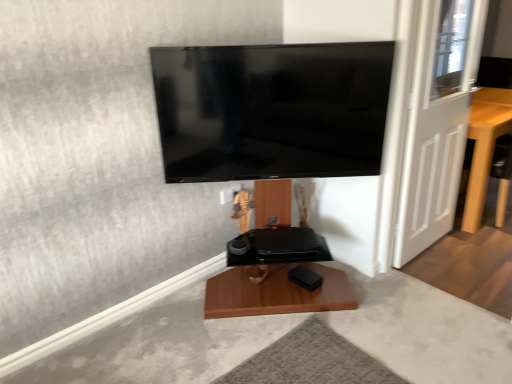
Question: Is white wooden door at right at the left side of light brown wooden table at right?

Choices:
 (A) no
 (B) yes

Answer: (B)

Question: Considering the relative sizes of white wooden door at right and light brown wooden table at right in the image provided, is white wooden door at right wider than light brown wooden table at right?

Choices:
 (A) no
 (B) yes

Answer: (A)

Question: From the image's perspective, is white wooden door at right located above light brown wooden table at right?

Choices:
 (A) yes
 (B) no

Answer: (A)

Question: Would you say light brown wooden table at right is part of white wooden door at right's contents?

Choices:
 (A) yes
 (B) no

Answer: (B)

Question: Is white wooden door at right facing away from light brown wooden table at right?

Choices:
 (A) no
 (B) yes

Answer: (A)

Question: Is white wooden door at right touching light brown wooden table at right?

Choices:
 (A) no
 (B) yes

Answer: (A)

Question: Is light brown wooden table at right touching flat screen tv at upper center?

Choices:
 (A) yes
 (B) no

Answer: (B)

Question: Considering the relative sizes of light brown wooden table at right and flat screen tv at upper center in the image provided, is light brown wooden table at right smaller than flat screen tv at upper center?

Choices:
 (A) yes
 (B) no

Answer: (B)

Question: Does light brown wooden table at right lie in front of flat screen tv at upper center?

Choices:
 (A) yes
 (B) no

Answer: (B)

Question: From a real-world perspective, is light brown wooden table at right on flat screen tv at upper center?

Choices:
 (A) yes
 (B) no

Answer: (B)

Question: Does light brown wooden table at right have a greater height compared to flat screen tv at upper center?

Choices:
 (A) no
 (B) yes

Answer: (B)

Question: Is light brown wooden table at right further to the viewer compared to flat screen tv at upper center?

Choices:
 (A) no
 (B) yes

Answer: (B)

Question: Is light brown wooden table at right looking in the opposite direction of white wooden door at right?

Choices:
 (A) no
 (B) yes

Answer: (A)